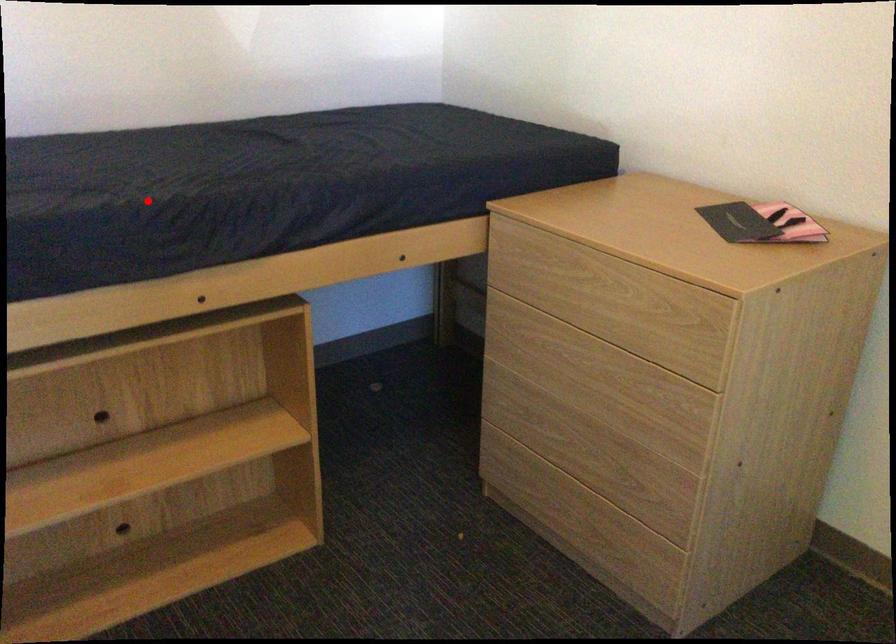
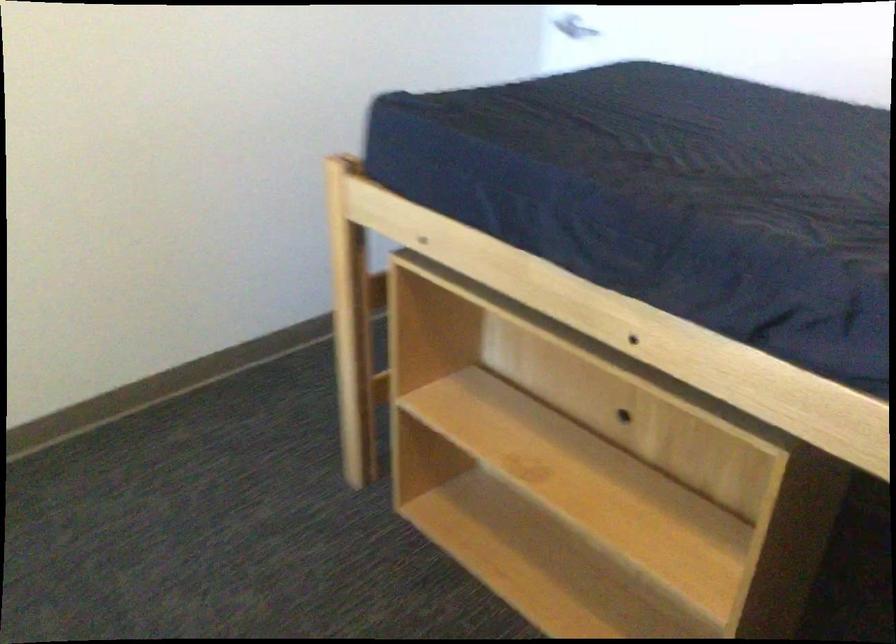
The point at the highlighted location is marked in the first image. Where is the corresponding point in the second image?

(651, 193)